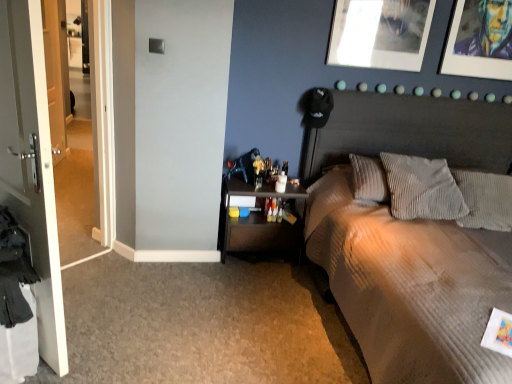
Question: From the image's perspective, is textured beige bed at upper right on gray corduroy pillow at right, acting as the second pillow starting from the left?

Choices:
 (A) yes
 (B) no

Answer: (B)

Question: Is the depth of textured beige bed at upper right greater than that of gray corduroy pillow at right, acting as the second pillow starting from the left?

Choices:
 (A) yes
 (B) no

Answer: (B)

Question: Considering the relative positions of textured beige bed at upper right and gray corduroy pillow at right, acting as the second pillow starting from the left, in the image provided, is textured beige bed at upper right to the left of gray corduroy pillow at right, acting as the second pillow starting from the left, from the viewer's perspective?

Choices:
 (A) yes
 (B) no

Answer: (A)

Question: From a real-world perspective, is textured beige bed at upper right on top of gray corduroy pillow at right, acting as the second pillow starting from the left?

Choices:
 (A) yes
 (B) no

Answer: (B)

Question: Is textured beige bed at upper right not near gray corduroy pillow at right, the 1th pillow from the right?

Choices:
 (A) no
 (B) yes

Answer: (A)

Question: Considering the relative positions of metallic silver picture frame at upper right, which is the 1th picture frame in right-to-left order, and white glossy door at left in the image provided, is metallic silver picture frame at upper right, which is the 1th picture frame in right-to-left order, to the left or to the right of white glossy door at left?

Choices:
 (A) left
 (B) right

Answer: (B)

Question: From a real-world perspective, relative to white glossy door at left, is metallic silver picture frame at upper right, which is the second picture frame in left-to-right order, vertically above or below?

Choices:
 (A) above
 (B) below

Answer: (A)

Question: Looking at their shapes, would you say metallic silver picture frame at upper right, which is the 1th picture frame in right-to-left order, is wider or thinner than white glossy door at left?

Choices:
 (A) wide
 (B) thin

Answer: (B)

Question: Relative to white glossy door at left, is metallic silver picture frame at upper right, which is the 1th picture frame in right-to-left order, in front or behind?

Choices:
 (A) behind
 (B) front

Answer: (A)

Question: Is point (489, 23) positioned closer to the camera than point (501, 190)?

Choices:
 (A) farther
 (B) closer

Answer: (A)

Question: From a real-world perspective, is metallic silver picture frame at upper right, which is the second picture frame in left-to-right order, above or below gray corduroy pillow at right, the 1th pillow from the right?

Choices:
 (A) below
 (B) above

Answer: (B)

Question: Is metallic silver picture frame at upper right, which is the 1th picture frame in right-to-left order, to the left or to the right of gray corduroy pillow at right, acting as the second pillow starting from the left, in the image?

Choices:
 (A) right
 (B) left

Answer: (A)

Question: From the image's perspective, is metallic silver picture frame at upper right, which is the 1th picture frame in right-to-left order, located above or below gray corduroy pillow at right, the 1th pillow from the right?

Choices:
 (A) above
 (B) below

Answer: (A)

Question: Considering the positions of metallic silver picture frame at upper center, which appears as the first picture frame when viewed from the left, and gray corduroy pillow at right, the 1th pillow from the right, in the image, is metallic silver picture frame at upper center, which appears as the first picture frame when viewed from the left, bigger or smaller than gray corduroy pillow at right, the 1th pillow from the right,?

Choices:
 (A) small
 (B) big

Answer: (A)

Question: In the image, is metallic silver picture frame at upper center, acting as the second picture frame starting from the right, positioned in front of or behind gray corduroy pillow at right, acting as the second pillow starting from the left?

Choices:
 (A) front
 (B) behind

Answer: (B)